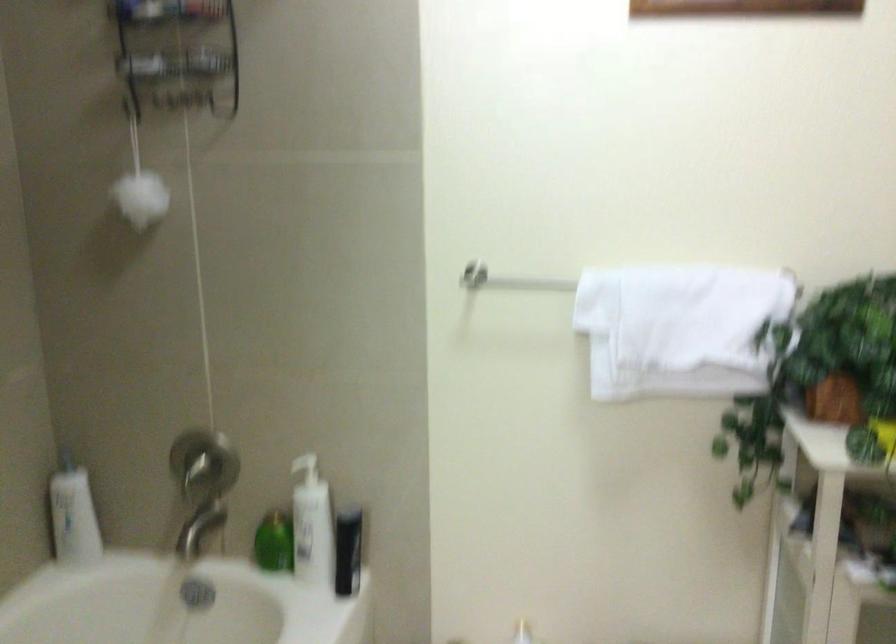
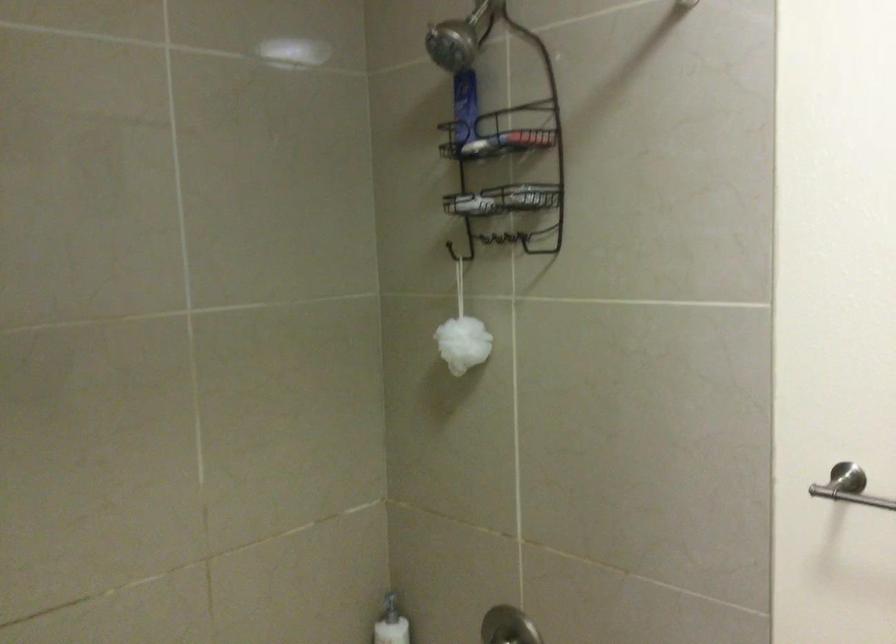
Question: The camera is either moving clockwise (left) or counter-clockwise (right) around the object. The first image is from the beginning of the video and the second image is from the end. Is the camera moving left or right when shooting the video?

Choices:
 (A) Left
 (B) Right

Answer: (B)